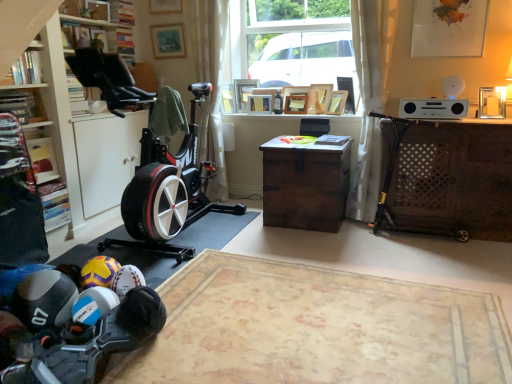
Find the location of a particular element. Image resolution: width=512 pixels, height=384 pixels. vacant space behind white matte baseball at lower left, which is counted as the first toy, starting from the back is located at coordinates (159, 282).